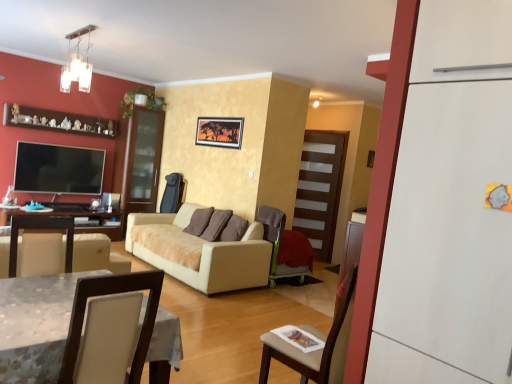
Where is `flat screen tv at left`? flat screen tv at left is located at coordinates (58, 169).

What is the approximate height of white matte refrigerator at right?

The height of white matte refrigerator at right is 6.40 feet.

Locate an element on the screen. Image resolution: width=512 pixels, height=384 pixels. velvet brown armchair at center, the first chair positioned from the back is located at coordinates (285, 246).

What do you see at coordinates (111, 294) in the screenshot? The image size is (512, 384). I see `white leather chair at lower left, arranged as the second chair when viewed from the back` at bounding box center [111, 294].

Identify the location of brown wooden table at left. (75, 223).

Could brown wooden table at left be considered to be inside beige fabric couch at center?

No, brown wooden table at left is not a part of beige fabric couch at center.

Can you tell me how much beige fabric couch at center and brown wooden table at left differ in facing direction?

90 degrees separate the facing orientations of beige fabric couch at center and brown wooden table at left.

Is beige fabric couch at center thinner than brown wooden table at left?

Incorrect, the width of beige fabric couch at center is not less than that of brown wooden table at left.

Considering the relative positions of beige fabric couch at center and brown wooden table at left in the image provided, is beige fabric couch at center to the left or to the right of brown wooden table at left?

Clearly, beige fabric couch at center is on the right of brown wooden table at left in the image.

Can you confirm if transparent glass door at center is thinner than clear glass chandelier at upper left?

Correct, the width of transparent glass door at center is less than that of clear glass chandelier at upper left.

Who is smaller, transparent glass door at center or clear glass chandelier at upper left?

With smaller size is clear glass chandelier at upper left.

This screenshot has height=384, width=512. I want to click on light fixture that is above the transparent glass door at center (from the image's perspective), so click(x=77, y=63).

From the image's perspective, is transparent glass door at center located above or below clear glass chandelier at upper left?

transparent glass door at center is situated lower than clear glass chandelier at upper left in the image.

Who is taller, brown wooden shelf at upper left or wooden framed picture at upper center?

With more height is wooden framed picture at upper center.

Considering the relative sizes of brown wooden shelf at upper left and wooden framed picture at upper center in the image provided, is brown wooden shelf at upper left wider than wooden framed picture at upper center?

Yes, brown wooden shelf at upper left is wider than wooden framed picture at upper center.

From the image's perspective, relative to wooden framed picture at upper center, is brown wooden shelf at upper left above or below?

brown wooden shelf at upper left is above wooden framed picture at upper center.

In the scene shown: Measure the distance between velvet brown armchair at center, the first chair positioned from the back, and wooden framed picture at upper center.

They are 1.55 meters apart.

Could you tell me if velvet brown armchair at center, marked as the 2th chair in a front-to-back arrangement, is facing wooden framed picture at upper center?

No, velvet brown armchair at center, marked as the 2th chair in a front-to-back arrangement, is not turned towards wooden framed picture at upper center.

From the image's perspective, which is above, velvet brown armchair at center, the first chair positioned from the back, or wooden framed picture at upper center?

From the image's view, wooden framed picture at upper center is above.

Which object is wider, brown wooden shelf at upper left or white leather chair at lower left, placed as the second chair when sorted from right to left?

With larger width is white leather chair at lower left, placed as the second chair when sorted from right to left.

Who is taller, brown wooden shelf at upper left or white leather chair at lower left, arranged as the second chair when viewed from the back?

With more height is white leather chair at lower left, arranged as the second chair when viewed from the back.

I want to click on chair that is the 2nd one when counting forward from the brown wooden shelf at upper left, so click(x=111, y=294).

From a real-world perspective, between brown wooden shelf at upper left and white leather chair at lower left, arranged as the second chair when viewed from the back, who is vertically lower?

In real-world perspective, white leather chair at lower left, arranged as the second chair when viewed from the back, is lower.

Is white leather chair at lower left, arranged as the second chair when viewed from the back, turned away from brown wooden table at left?

No.

Can you confirm if white leather chair at lower left, arranged as the second chair when viewed from the back, is smaller than brown wooden table at left?

Yes, white leather chair at lower left, arranged as the second chair when viewed from the back, is smaller than brown wooden table at left.

From a real-world perspective, is white leather chair at lower left, arranged as the 1th chair when viewed from the left, on top of brown wooden table at left?

Correct, in the physical world, white leather chair at lower left, arranged as the 1th chair when viewed from the left, is higher than brown wooden table at left.

Are white leather chair at lower left, which ranks as the 1th chair in front-to-back order, and brown wooden table at left located far from each other?

Yes, white leather chair at lower left, which ranks as the 1th chair in front-to-back order, and brown wooden table at left are quite far apart.

Is flat screen tv at left facing towards brown wooden table at left?

No, flat screen tv at left is not oriented towards brown wooden table at left.

From the image's perspective, is flat screen tv at left positioned above or below brown wooden table at left?

Clearly, from the image's perspective, flat screen tv at left is above brown wooden table at left.

Does flat screen tv at left have a larger size compared to brown wooden table at left?

Incorrect, flat screen tv at left is not larger than brown wooden table at left.

From a real-world perspective, which object rests below the other?

In real-world perspective, brown wooden table at left is lower.

Locate an element on the screen. table on the left of beige fabric couch at center is located at coordinates (75, 223).

Locate an element on the screen. This screenshot has width=512, height=384. glass door that appears behind the clear glass chandelier at upper left is located at coordinates (320, 189).

Based on their spatial positions, is wooden framed picture at upper center or brown wooden shelf at upper left closer to velvet brown armchair at center, positioned as the 1th chair in right-to-left order?

Among the two, wooden framed picture at upper center is located nearer to velvet brown armchair at center, positioned as the 1th chair in right-to-left order.

Looking at the image, which one is located closer to flat screen tv at left, transparent glass door at center or velvet brown armchair at center, the first chair positioned from the back?

Among the two, velvet brown armchair at center, the first chair positioned from the back, is located nearer to flat screen tv at left.

From the image, which object appears to be nearer to flat screen tv at left, white matte refrigerator at right or wooden framed picture at upper center?

Among the two, wooden framed picture at upper center is located nearer to flat screen tv at left.

Consider the image. Looking at the image, which one is located closer to brown wooden table at left, wooden framed picture at upper center or white matte refrigerator at right?

Among the two, wooden framed picture at upper center is located nearer to brown wooden table at left.

When comparing their distances from white matte refrigerator at right, does brown wooden shelf at upper left or wooden framed picture at upper center seem closer?

Among the two, wooden framed picture at upper center is located nearer to white matte refrigerator at right.

Which object lies further to the anchor point transparent glass door at center, flat screen tv at left or brown wooden table at left?

Among the two, flat screen tv at left is located further to transparent glass door at center.

Which object lies further to the anchor point white leather chair at lower left, arranged as the second chair when viewed from the back, brown wooden shelf at upper left or transparent glass door at center?

Based on the image, brown wooden shelf at upper left appears to be further to white leather chair at lower left, arranged as the second chair when viewed from the back.

Consider the image. Considering their positions, is clear glass chandelier at upper left positioned closer to velvet brown armchair at center, arranged as the 2th chair when viewed from the left, than flat screen tv at left?

flat screen tv at left is closer to velvet brown armchair at center, arranged as the 2th chair when viewed from the left.

Find the location of a particular element. The height and width of the screenshot is (384, 512). light fixture between flat screen tv at left and transparent glass door at center in the horizontal direction is located at coordinates (77, 63).

Locate an element on the screen. light fixture between brown wooden table at left and wooden framed picture at upper center from left to right is located at coordinates (77, 63).

At what (x,y) coordinates should I click in order to perform the action: click on light fixture between white leather chair at lower left, placed as the second chair when sorted from right to left, and wooden framed picture at upper center, along the z-axis. Please return your answer as a coordinate pair (x, y). Image resolution: width=512 pixels, height=384 pixels. Looking at the image, I should click on (77, 63).

Locate an element on the screen. Image resolution: width=512 pixels, height=384 pixels. light fixture located between brown wooden table at left and velvet brown armchair at center, arranged as the 2th chair when viewed from the left, in the left-right direction is located at coordinates (77, 63).